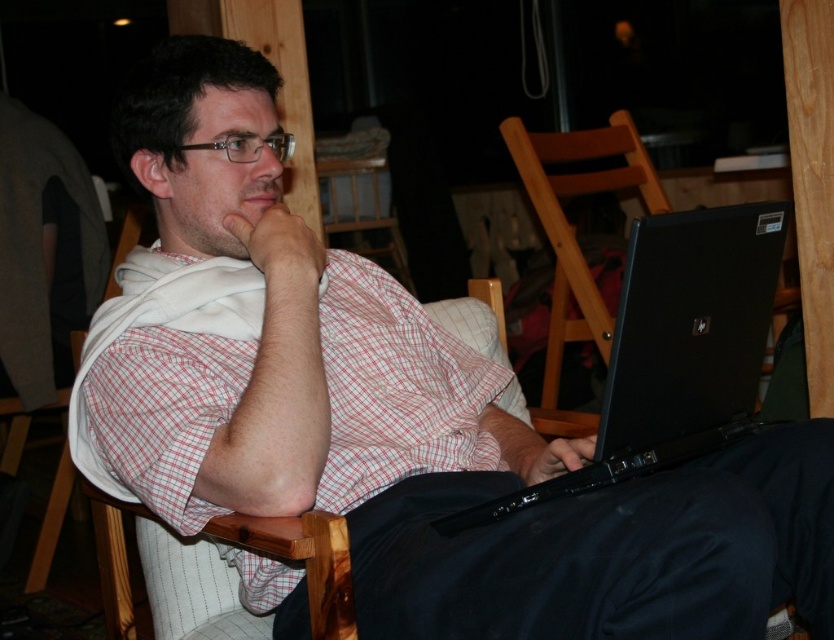
Who is positioned more to the left, white checkered shirt at center or wooden chair at center?

white checkered shirt at center is more to the left.

Does point (355, 400) lie in front of point (553, 324)?

Yes, point (355, 400) is closer to viewer.

Find the location of `white checkered shirt at center`. white checkered shirt at center is located at coordinates (163, 380).

Locate an element on the screen. The image size is (834, 640). white checkered shirt at center is located at coordinates (163, 380).

Is white checkered shirt at center further to the viewer compared to black matte laptop at lower right?

That is True.

Is white checkered shirt at center wider than black matte laptop at lower right?

Indeed, white checkered shirt at center has a greater width compared to black matte laptop at lower right.

Does point (448, 397) come in front of point (676, 420)?

No, (448, 397) is further to viewer.

Image resolution: width=834 pixels, height=640 pixels. I want to click on white checkered shirt at center, so click(163, 380).

Between black matte laptop at lower right and wooden chair at center, which one has less height?

With less height is black matte laptop at lower right.

Locate an element on the screen. The width and height of the screenshot is (834, 640). black matte laptop at lower right is located at coordinates (676, 349).

This screenshot has height=640, width=834. What are the coordinates of `black matte laptop at lower right` in the screenshot? It's located at (676, 349).